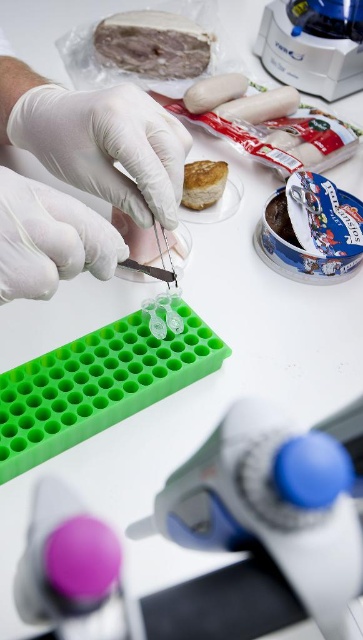
You are standing in the laboratory scene. There are two points marked as point 1 at coordinates (x=188, y=483) and point 2 at coordinates (x=111, y=19). Which point is closer to you?

Point 1 at coordinates (x=188, y=483) is closer to you because it is in front of point 2 at coordinates (x=111, y=19).